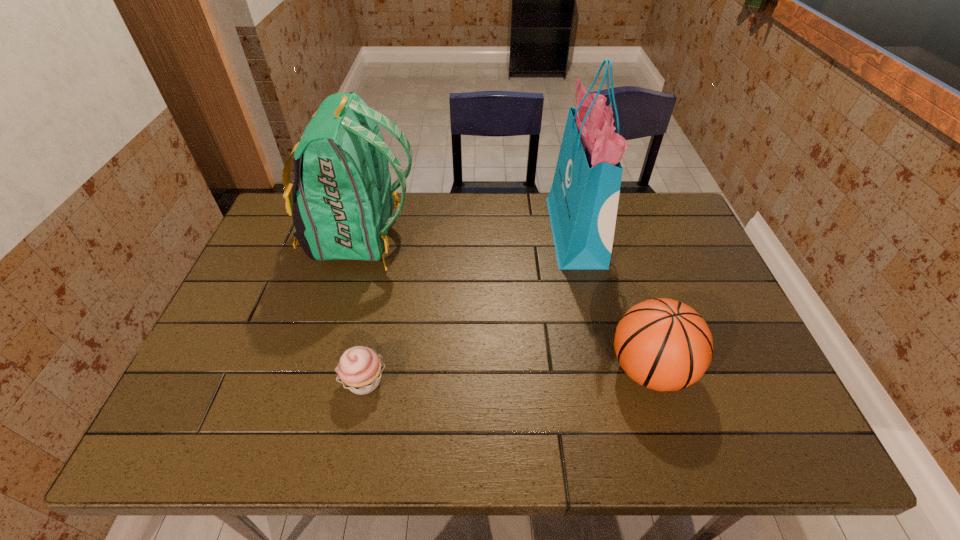
Where is `unoccupied area between the backpack and the shopping bag`? This screenshot has width=960, height=540. unoccupied area between the backpack and the shopping bag is located at coordinates (468, 235).

Identify the location of empty space that is in between the basketball and the shortest object. (507, 375).

Locate an element on the screen. The height and width of the screenshot is (540, 960). free point between the shopping bag and the third tallest object is located at coordinates (612, 301).

Identify the location of vacant space that is in between the second tallest object and the shopping bag. The image size is (960, 540). (468, 235).

The width and height of the screenshot is (960, 540). I want to click on unoccupied position between the basketball and the backpack, so click(x=505, y=303).

Where is `free spot between the shopping bag and the second tallest object`? This screenshot has width=960, height=540. free spot between the shopping bag and the second tallest object is located at coordinates (468, 235).

Where is `free space between the second tallest object and the shopping bag`? The image size is (960, 540). free space between the second tallest object and the shopping bag is located at coordinates (468, 235).

Identify which object is located as the third nearest to the shopping bag. Please provide its 2D coordinates. Your answer should be formatted as a tuple, i.e. [(x, y)], where the tuple contains the x and y coordinates of a point satisfying the conditions above.

[(360, 368)]

In order to click on the second closest object to the third shortest object in this screenshot , I will do `click(583, 201)`.

Find the location of a particular element. vacant space that satisfies the following two spatial constraints: 1. on the back side of the shortest object; 2. on the right side of the basketball is located at coordinates (367, 369).